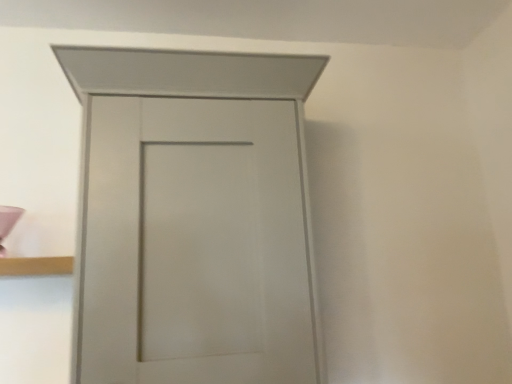
In order to face matte white door at center, should I rotate leftwards or rightwards?

You should look left and rotate roughly 8.062 degrees.

This screenshot has height=384, width=512. What do you see at coordinates (195, 244) in the screenshot?
I see `matte white door at center` at bounding box center [195, 244].

I want to click on matte white door at center, so click(x=195, y=244).

Identify the location of matte white door at center. The height and width of the screenshot is (384, 512). (195, 244).